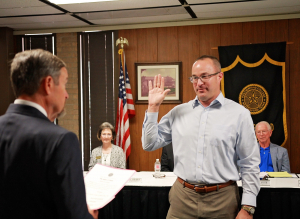
Locate an element on the screen. Image resolution: width=300 pixels, height=219 pixels. curtains is located at coordinates (90, 79), (41, 40).